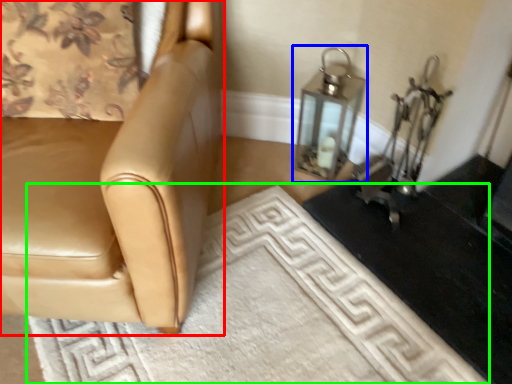
Question: Which is farther away from chair (highlighted by a red box)? oil lamp (highlighted by a blue box) or doormat (highlighted by a green box)?

Choices:
 (A) oil lamp
 (B) doormat

Answer: (A)